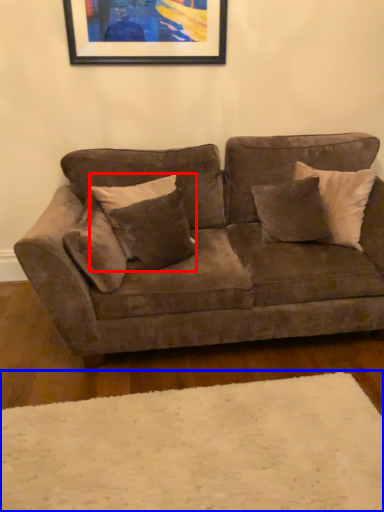
Question: Which point is closer to the camera, pillow (highlighted by a red box) or plain (highlighted by a blue box)?

Choices:
 (A) pillow
 (B) plain

Answer: (B)